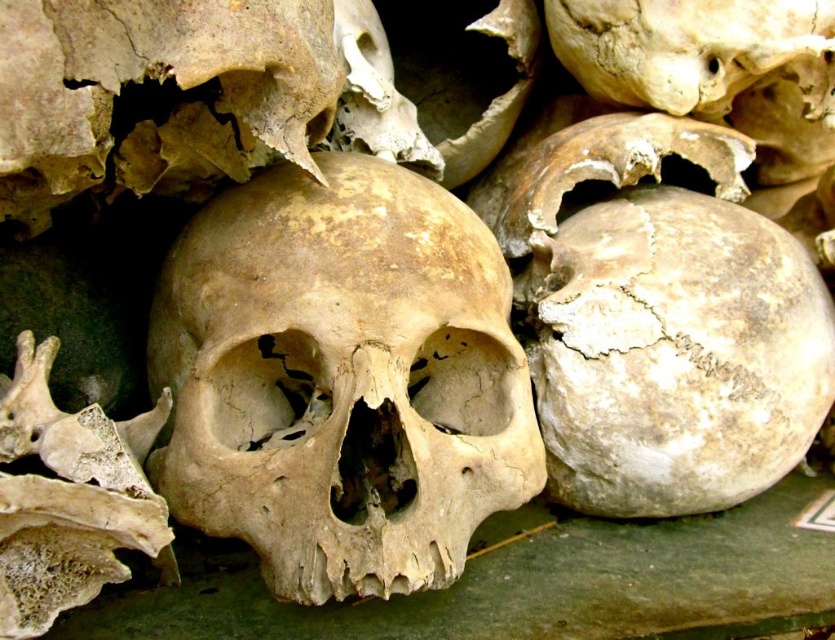
Locate an element on the screen. This screenshot has height=640, width=835. white cracked skull at center is located at coordinates (672, 353).

Who is more forward, (547,323) or (36,625)?

Positioned in front is point (36,625).

Is point (554, 340) positioned behind point (33, 604)?

Yes, point (554, 340) is behind point (33, 604).

The height and width of the screenshot is (640, 835). Find the location of `white cracked skull at center`. white cracked skull at center is located at coordinates (672, 353).

Does brown porous skull at center appear on the right side of white cracked skull at center?

Incorrect, brown porous skull at center is not on the right side of white cracked skull at center.

Identify the location of brown porous skull at center. This screenshot has width=835, height=640. (342, 378).

Is brown porous skull at center smaller than bone-like textured bone fragment at lower left?

No, brown porous skull at center is not smaller than bone-like textured bone fragment at lower left.

In the scene shown: Which of these two, brown porous skull at center or bone-like textured bone fragment at lower left, stands taller?

brown porous skull at center

Describe the element at coordinates (342, 378) in the screenshot. I see `brown porous skull at center` at that location.

The width and height of the screenshot is (835, 640). I want to click on brown porous skull at center, so pyautogui.click(x=342, y=378).